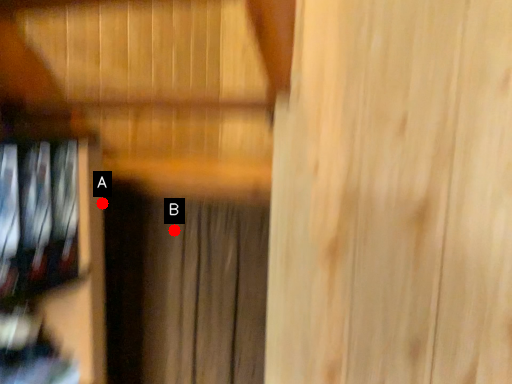
Question: Two points are circled on the image, labeled by A and B beside each circle. Which point is closer to the camera?

Choices:
 (A) A is closer
 (B) B is closer

Answer: (A)